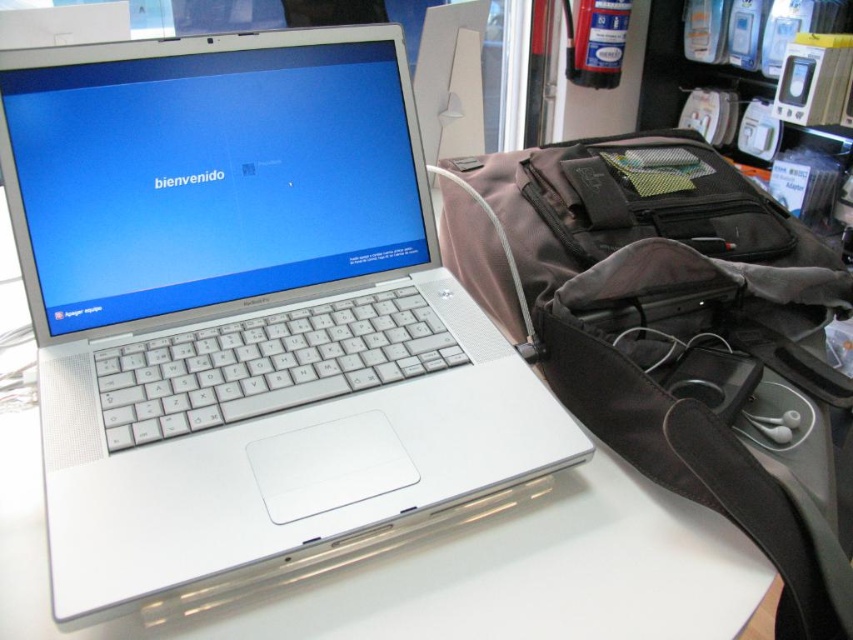
You are a delivery person who needs to place a package on the desk where the silver metallic laptop at center is located. The package is 14 inches wide. Can you place the package so that it doesn

The distance between the silver metallic laptop at center and the camera is 13.84 inches. Since the package is 14 inches wide, it might not fit without overlapping the laptop or the edge of the desk. Check the desk

You are a photographer trying to capture a closeup of the laptop screen. You have two points marked on the laptop screen, point (86, 168) and point (775, 268). Which point should you focus on to ensure the closest part of the screen is in focus?

Point (86, 168) is closer to the camera than point (775, 268), so you should focus on point (86, 168) to ensure the closest part of the screen is in focus.

You are holding a 12 inch ruler and want to measure the distance from the camera to the point at coordinates point [332,532]. Can your ruler reach that point?

The distance between the camera and point [332,532] is 15.72 inches. Since your ruler is only 12 inches long, it cannot reach that point.